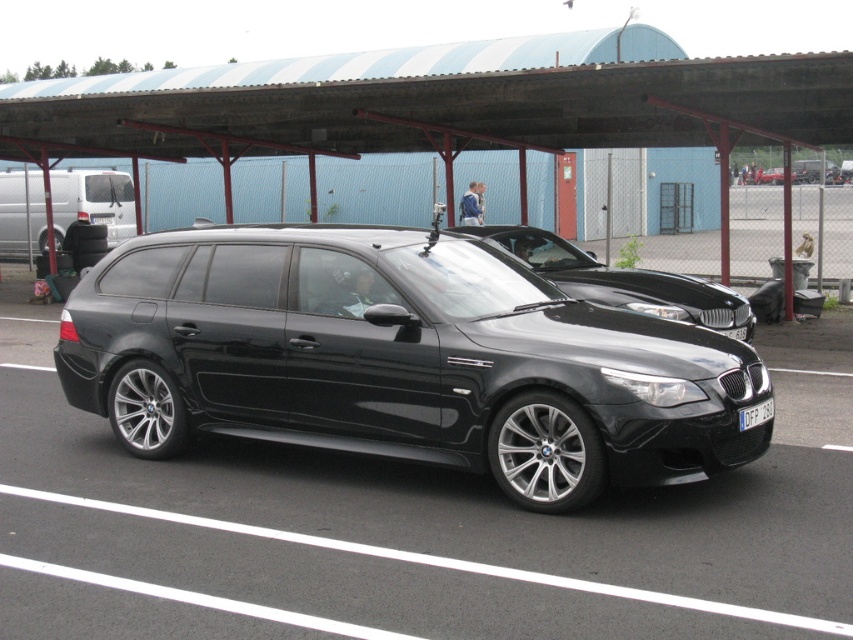
You are standing in front of the black BMW E61 M5 Touring parked under a covered parking structure. You notice two points marked on the car, one at point coordinates (22, 224) and the other at coordinates (747, 406). Which point is closer to you as you face the car?

Point (22, 224) is closer to you because it is further to the camera than point (747, 406), meaning it is positioned nearer in the visual plane.